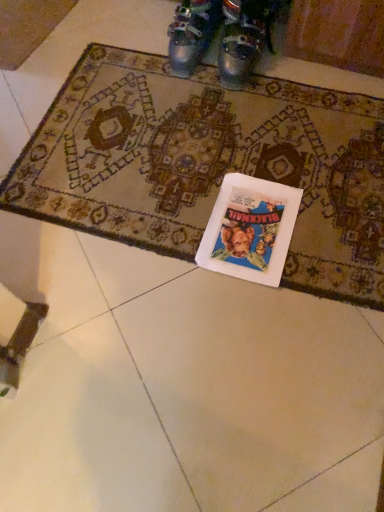
Question: From a real-world perspective, relative to metallic silver boots at upper center, which is counted as the first footwear, starting from the left, is white paper book at center vertically above or below?

Choices:
 (A) below
 (B) above

Answer: (A)

Question: Is white paper book at center spatially inside metallic silver boots at upper center, which is counted as the first footwear, starting from the left, or outside of it?

Choices:
 (A) inside
 (B) outside

Answer: (B)

Question: Based on their relative distances, which object is nearer to the white paper book at center?

Choices:
 (A) metallic silver shoes at upper center, which ranks as the second footwear in left-to-right order
 (B) metallic silver boots at upper center, which is counted as the first footwear, starting from the left
 (C) carpeted mat at center

Answer: (C)

Question: Which of these objects is positioned farthest from the white paper book at center?

Choices:
 (A) carpeted mat at center
 (B) metallic silver boots at upper center, the second footwear when ordered from right to left
 (C) metallic silver shoes at upper center, which ranks as the second footwear in left-to-right order

Answer: (B)